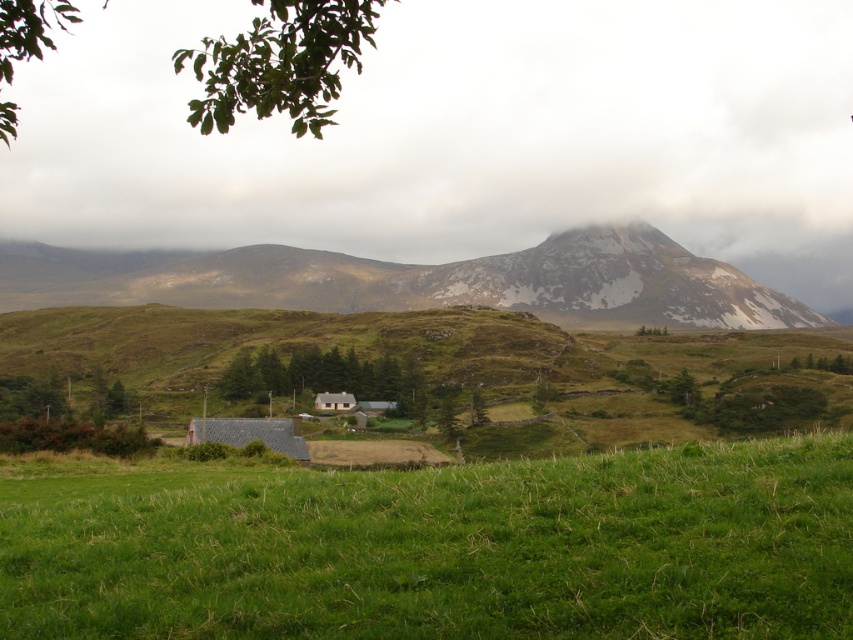
Question: Which of these objects is positioned farthest from the wooden cabin at center?

Choices:
 (A) rugged stone mountain at upper center
 (B) green grassy field at center
 (C) gray slate roof at lower center

Answer: (A)

Question: Does green grassy field at center have a smaller size compared to wooden cabin at center?

Choices:
 (A) no
 (B) yes

Answer: (A)

Question: Which object is positioned closest to the rugged stone mountain at upper center?

Choices:
 (A) wooden cabin at center
 (B) gray slate roof at lower center

Answer: (A)

Question: Can you confirm if gray slate roof at lower center is wider than wooden cabin at center?

Choices:
 (A) yes
 (B) no

Answer: (A)

Question: Does gray slate roof at lower center have a greater width compared to wooden cabin at center?

Choices:
 (A) no
 (B) yes

Answer: (B)

Question: Which object is farther from the camera taking this photo?

Choices:
 (A) green grassy field at center
 (B) rugged stone mountain at upper center
 (C) gray slate roof at lower center
 (D) wooden cabin at center

Answer: (B)